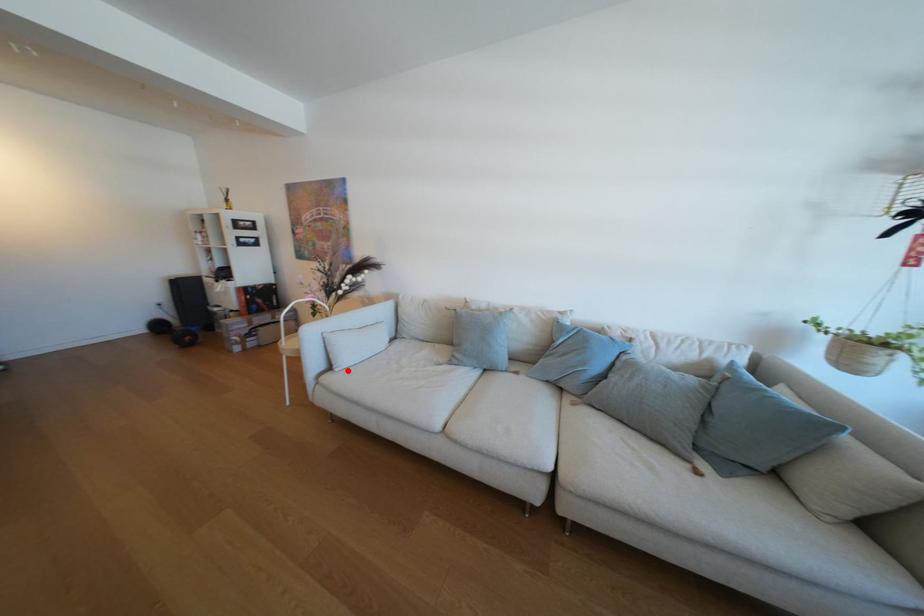
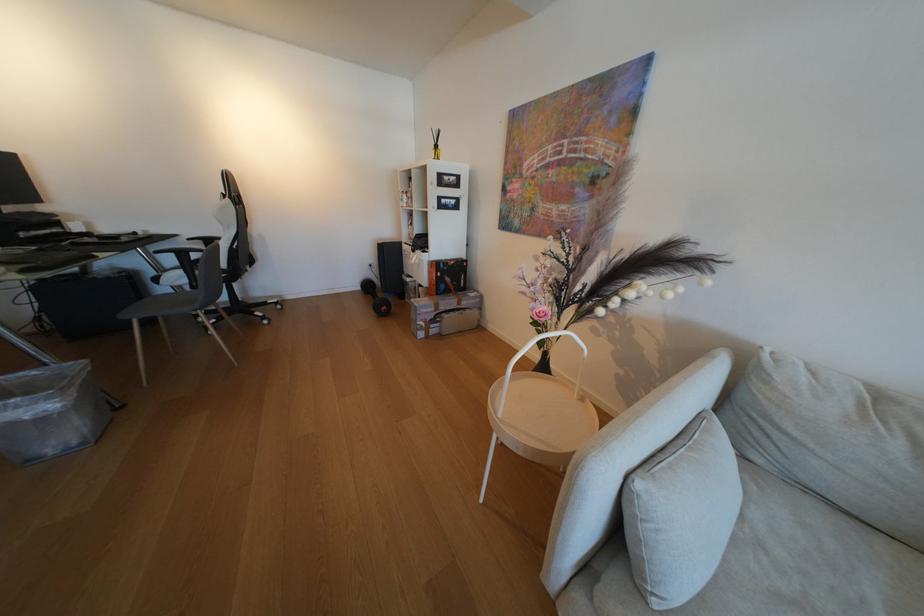
Find the pixel in the second image that matches the highlighted location in the first image.

(665, 604)